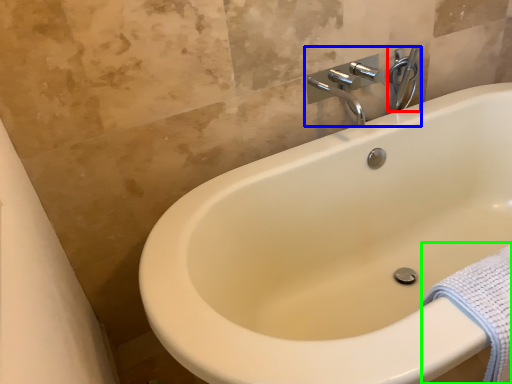
Question: Estimate the real-world distances between objects in this image. Which object is farther from plumbing fixture (highlighted by a red box), tap (highlighted by a blue box) or bath towel (highlighted by a green box)?

Choices:
 (A) tap
 (B) bath towel

Answer: (B)